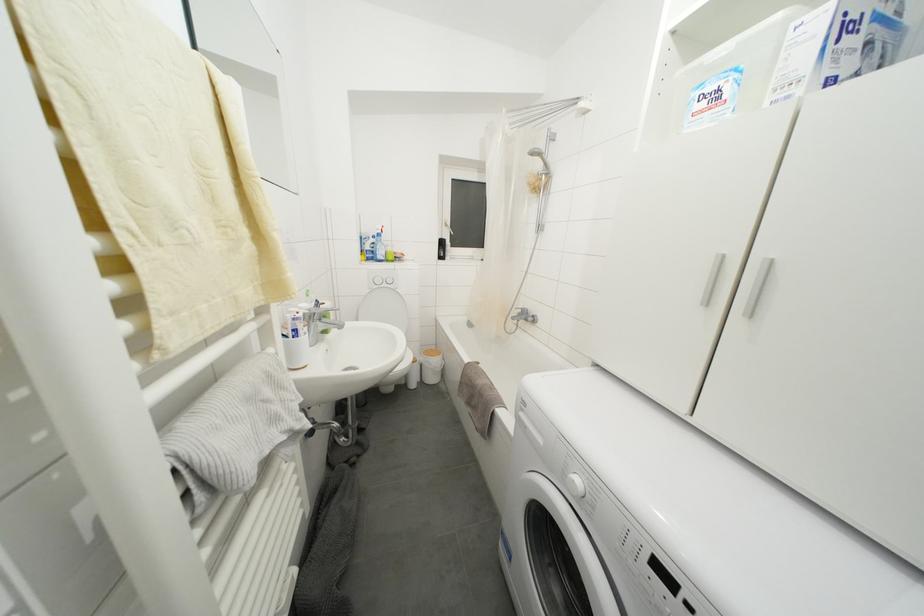
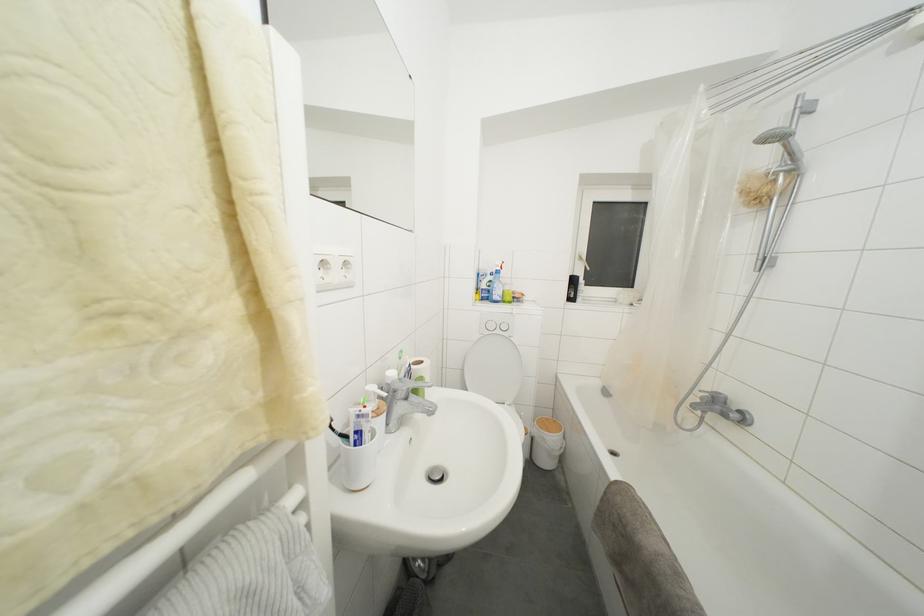
Locate, in the second image, the point that corresponds to [470,368] in the first image.

(617, 484)